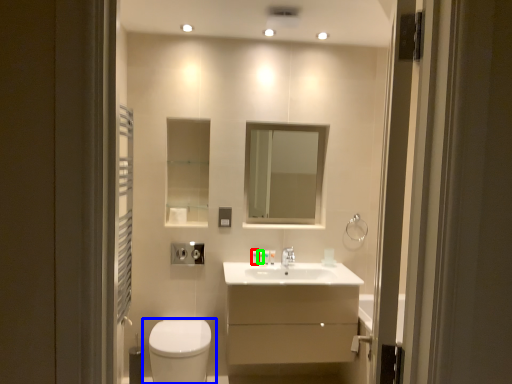
Question: Which object is the closest to the toiletry (highlighted by a red box)? Choose among these: toilet (highlighted by a blue box) or toiletry (highlighted by a green box).

Choices:
 (A) toilet
 (B) toiletry

Answer: (B)